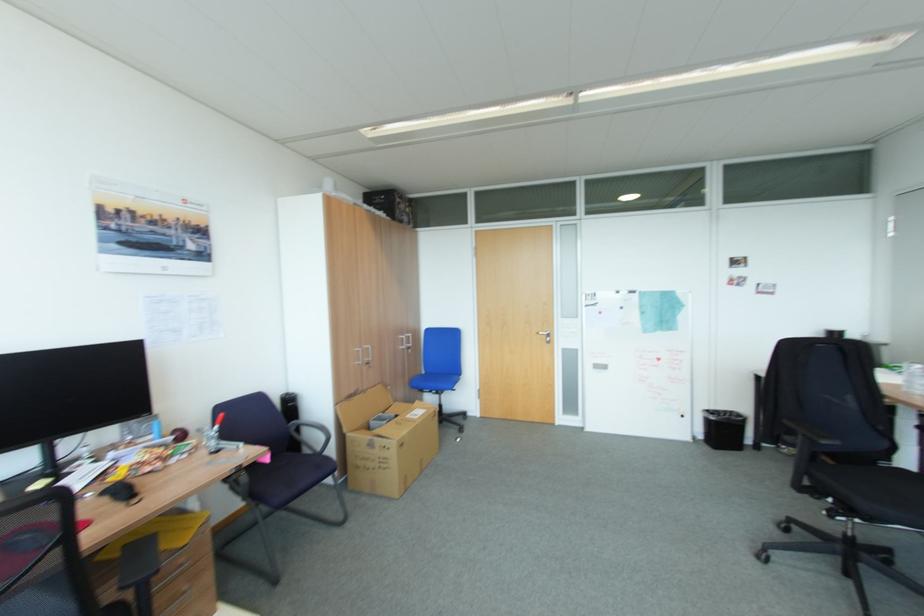
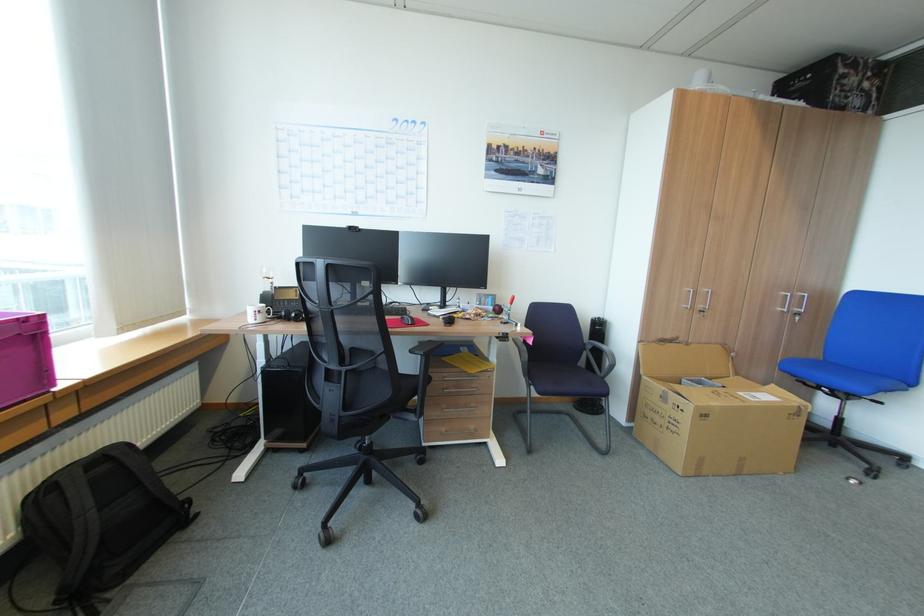
Where in the second image is the point corresponding to the point at 184,434 from the first image?

(502, 307)